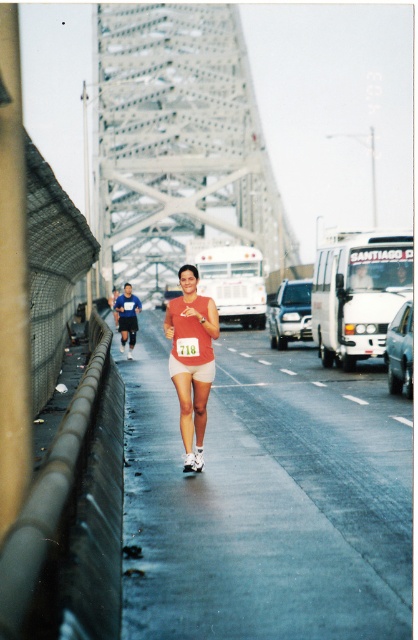
You are a runner in the marathon and you see two points marked on the bridge. The first point is at coordinates point (170, 108) and the second point is at coordinates point (183, 337). Which point is closer to your current position if you are standing at the starting line of the bridge?

Point (183, 337) is closer to your current position because it is in front of point (170, 108), which is behind it.

You are a photographer standing at the starting line of the marathon. You want to capture the runner wearing a red tank top and white shorts with the gray metallic bridge at center in the background. Where should you position your camera to ensure the bridge is centered in the photo?

To center the gray metallic bridge at center in the photo, position the camera at the point corresponding to the bridge coordinates, which is at (x=178, y=141) in the image plane.